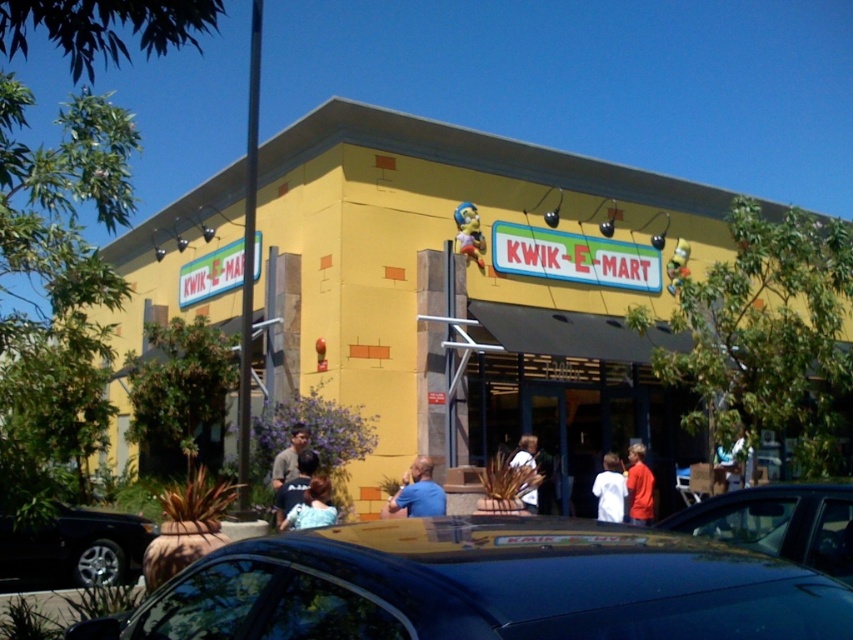
Is light brown leather jacket at lower center closer to camera compared to white fabric shirt at center?

Yes, light brown leather jacket at lower center is closer to the viewer.

Does light brown leather jacket at lower center lie behind white fabric shirt at center?

No, it is in front of white fabric shirt at center.

Is point (292, 436) closer to camera compared to point (531, 492)?

Yes.

Where is `light brown leather jacket at lower center`? The image size is (853, 640). light brown leather jacket at lower center is located at coordinates (289, 456).

Is point (16, 576) more distant than point (305, 515)?

Yes, it is behind point (305, 515).

Which of these two, shiny black car at lower left or blue fabric shirt at lower center, stands shorter?

Standing shorter between the two is blue fabric shirt at lower center.

Image resolution: width=853 pixels, height=640 pixels. What do you see at coordinates (74, 548) in the screenshot?
I see `shiny black car at lower left` at bounding box center [74, 548].

I want to click on shiny black car at lower left, so click(x=74, y=548).

Based on the photo, does red matte shirt at center have a lesser height compared to light brown leather jacket at lower center?

Incorrect, red matte shirt at center's height does not fall short of light brown leather jacket at lower center's.

Does point (631, 496) come farther from viewer compared to point (300, 433)?

Yes, it is behind point (300, 433).

At what (x,y) coordinates should I click in order to perform the action: click on red matte shirt at center. Please return your answer as a coordinate pair (x, y). The height and width of the screenshot is (640, 853). Looking at the image, I should click on (639, 486).